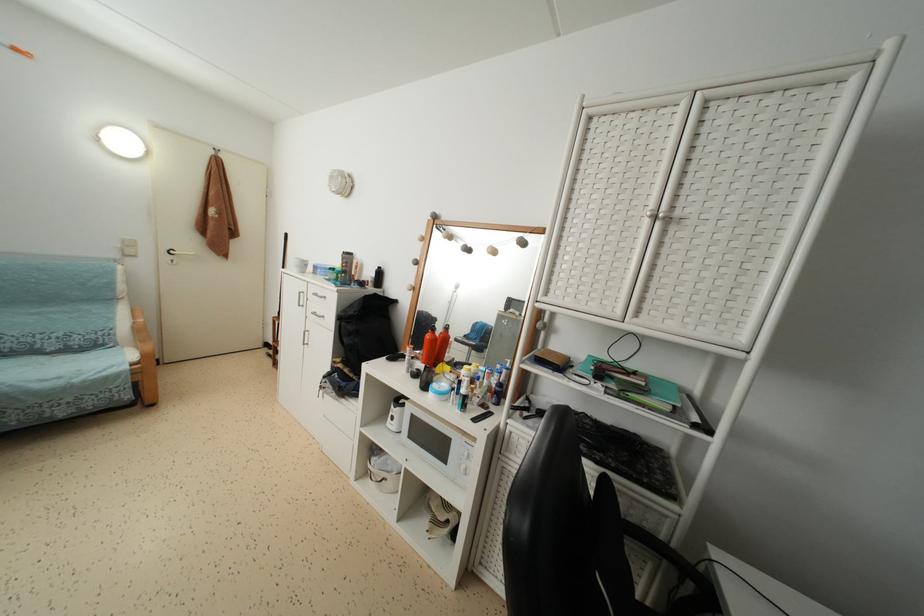
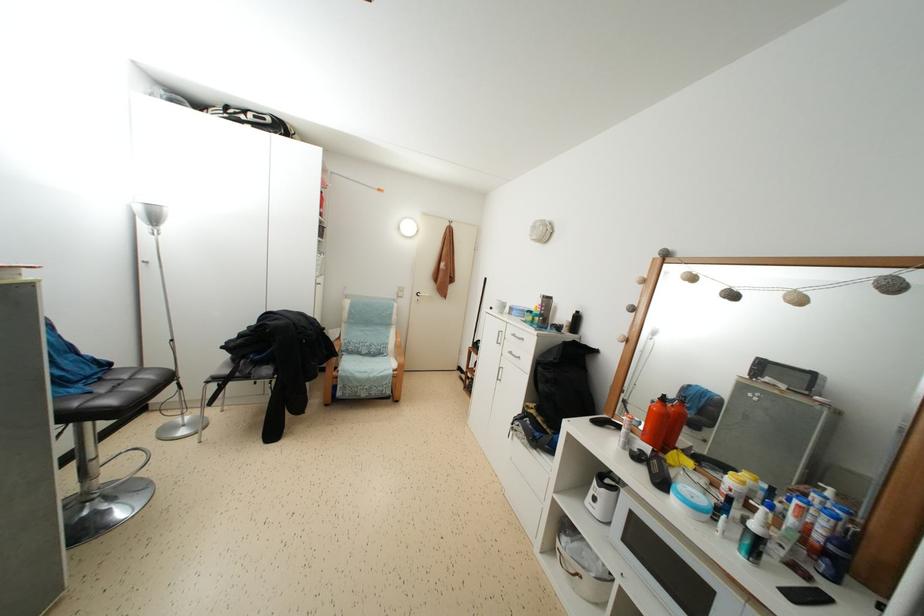
Where in the second image is the point corresponding to (x=377, y=456) from the first image?

(566, 532)